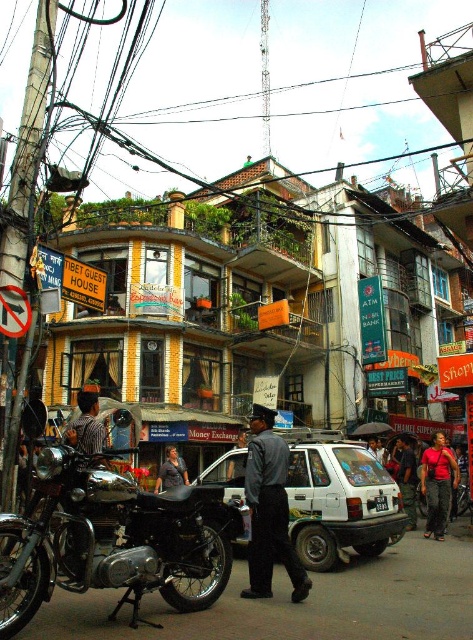
You are a pedestrian standing at the edge of the street in this scene. You see a white matte car at center and a dark gray shirt at center. If you want to cross the street to reach the building in the middle ground, which object would you pass closer to first?

The dark gray shirt at center is closer to you than the white matte car at center since it is only 21.94 meters away. Therefore, you would pass closer to the dark gray shirt at center first before reaching the white matte car at center.

You are a pedestrian standing on the sidewalk in this street scene. You notice a white matte car at center and a dark gray shirt at center. Which object is closer to your right side?

The white matte car at center is to the right of dark gray shirt at center, so the white matte car at center is closer to your right side.